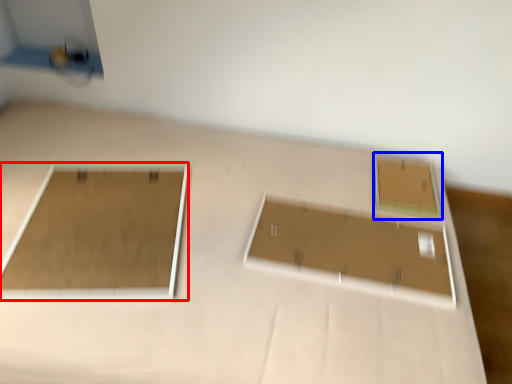
Question: Which of the following is the closest to the observer, rectangle (highlighted by a red box) or rectangle (highlighted by a blue box)?

Choices:
 (A) rectangle
 (B) rectangle

Answer: (A)